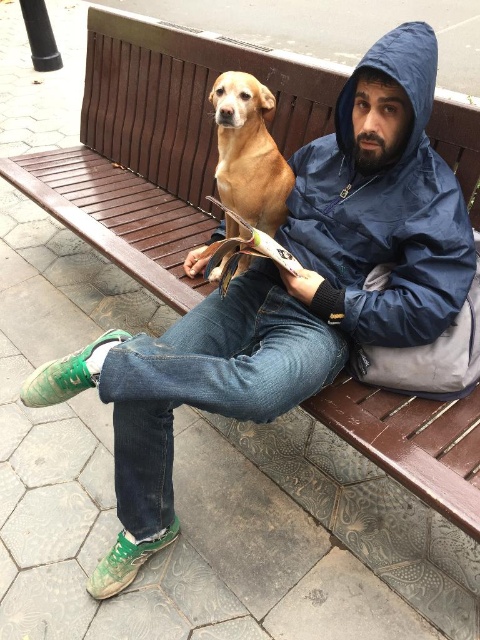
Does blue waterproof jacket at upper right lie behind golden brown fur at center?

No, blue waterproof jacket at upper right is in front of golden brown fur at center.

Is point (336, 205) positioned before point (222, 88)?

Yes, point (336, 205) is in front of point (222, 88).

Image resolution: width=480 pixels, height=640 pixels. Identify the location of blue waterproof jacket at upper right. (384, 212).